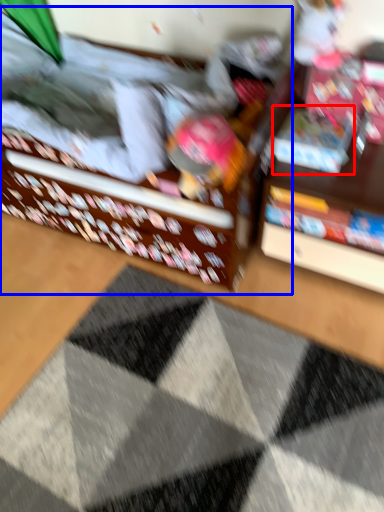
Question: Among these objects, which one is nearest to the camera, book (highlighted by a red box) or bed (highlighted by a blue box)?

Choices:
 (A) book
 (B) bed

Answer: (B)